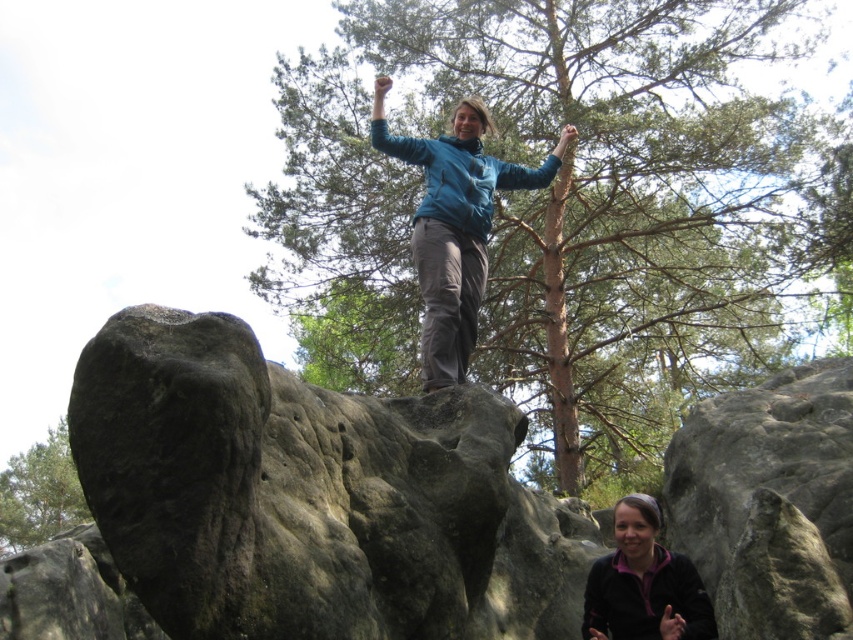
Question: Which object appears closest to the camera in this image?

Choices:
 (A) green leafy tree at upper left
 (B) brown textured tree at upper center
 (C) matte black jacket at lower center

Answer: (C)

Question: Is the position of brown textured tree at upper center less distant than that of green leafy tree at upper left?

Choices:
 (A) no
 (B) yes

Answer: (B)

Question: Is teal fabric jacket at center closer to camera compared to matte black jacket at lower center?

Choices:
 (A) no
 (B) yes

Answer: (A)

Question: Is matte black jacket at lower center bigger than green leafy tree at upper left?

Choices:
 (A) yes
 (B) no

Answer: (B)

Question: Which point is farther from the camera taking this photo?

Choices:
 (A) (27, 522)
 (B) (653, 634)
 (C) (546, 8)
 (D) (486, 120)

Answer: (A)

Question: Which point is closer to the camera?

Choices:
 (A) brown textured tree at upper center
 (B) green leafy tree at upper left

Answer: (A)